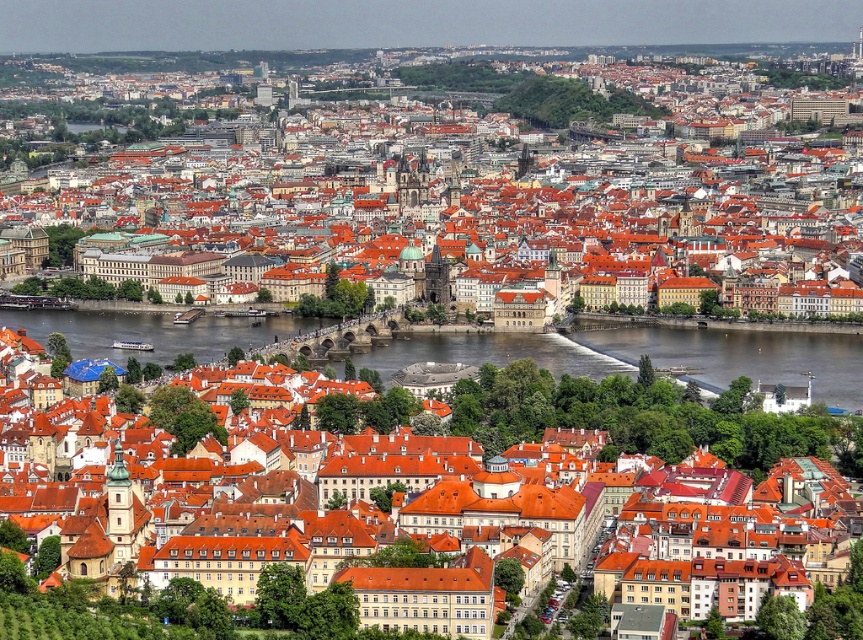
Based on the scene description, which object occupies a greater area in the image between the matte orange rooftops at center and the brown water at center?

The matte orange rooftops at center has a larger size compared to brown water at center, so it occupies a greater area in the image.

You are a tourist in Prague. You see the matte orange rooftops at center and the brown water at center in the distance. Which one is wider from your perspective?

The brown water at center is wider than the matte orange rooftops at center because the matte orange rooftops at center has a smaller width compared to the brown water at center.